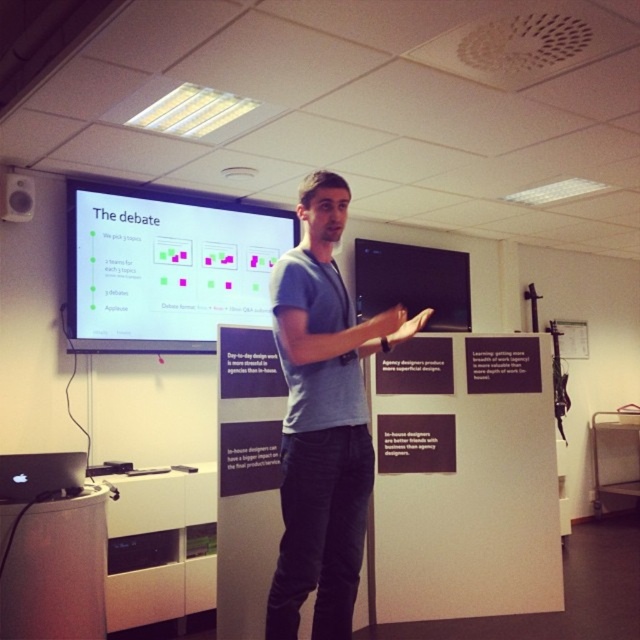
Question: From the image, what is the correct spatial relationship of white glossy projection screen at upper center in relation to black glossy projection screen at upper center?

Choices:
 (A) left
 (B) right

Answer: (A)

Question: Estimate the real-world distances between objects in this image. Which object is closer to the blue cotton shirt at center?

Choices:
 (A) black matte poster at center
 (B) black glossy projection screen at upper center
 (C) matte black speaker at upper left

Answer: (A)

Question: Where is black matte poster at center located in relation to matte black speaker at upper left in the image?

Choices:
 (A) right
 (B) left

Answer: (A)

Question: Estimate the real-world distances between objects in this image. Which object is farther from the black matte poster at center?

Choices:
 (A) matte black speaker at upper left
 (B) blue cotton shirt at center
 (C) black glossy projection screen at upper center
 (D) white glossy projection screen at upper center

Answer: (A)

Question: Does black glossy projection screen at upper center have a greater width compared to matte black speaker at upper left?

Choices:
 (A) no
 (B) yes

Answer: (B)

Question: Which object is closer to the camera taking this photo?

Choices:
 (A) blue cotton shirt at center
 (B) white glossy projection screen at upper center
 (C) black glossy projection screen at upper center
 (D) black matte poster at center

Answer: (A)